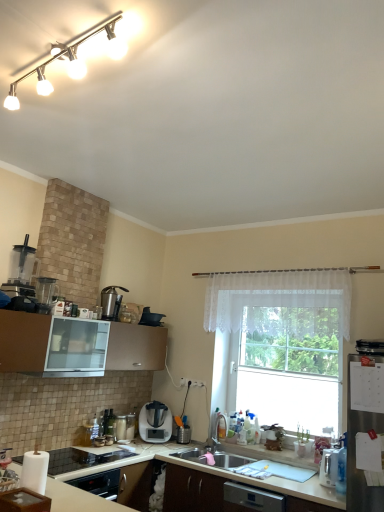
You are a GUI agent. You are given a task and a screenshot of the screen. Output one action in this format:
    pyautogui.click(x=<x>, y=<y>)
    Task: Click on the free spot in front of metallic silver toaster at lower left, positioned as the 2th appliance in left-to-right order
    
    Given the screenshot: What is the action you would take?
    pyautogui.click(x=82, y=446)